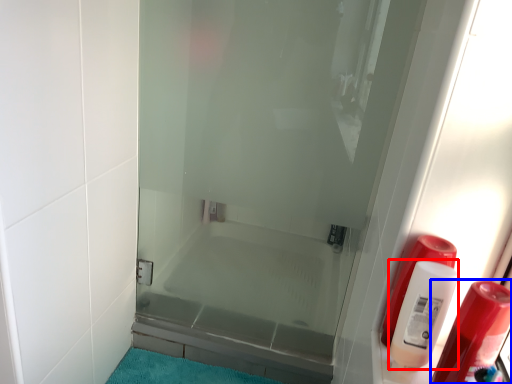
Question: Which object is further to the camera taking this photo, cleaning product (highlighted by a red box) or soap dispenser (highlighted by a blue box)?

Choices:
 (A) cleaning product
 (B) soap dispenser

Answer: (A)